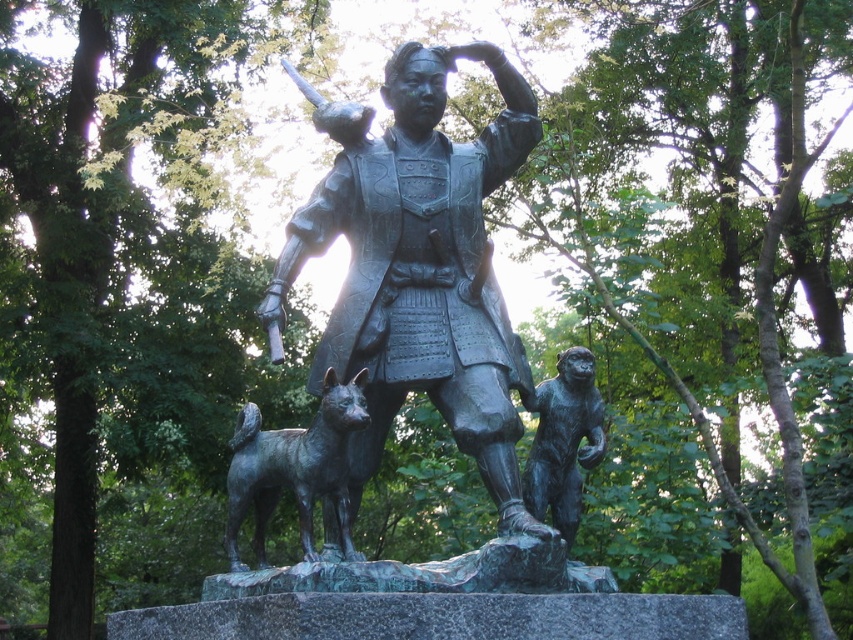
You are a tour guide leading a group to the bronze monkey at right. The bronze dog at center is blocking the path. Can you walk through the space between them?

The distance between bronze dog at center and bronze monkey at right is 3.73 meters, so yes, you can walk through the space between them since it is wide enough for a person to pass through.

What are the coordinates of the bronze statue at center?

The bronze statue at center is located at coordinates (416, 266).

You are an art student observing the statue and its surroundings. You need to sketch the statue first. Which of the two animals, the bronze dog at center or the bronze monkey at right, should you draw first to ensure proper perspective?

The bronze dog at center should be drawn first because it is in front of the bronze monkey at right, so it should be sketched before the monkey to maintain the correct spatial relationship in your perspective drawing.